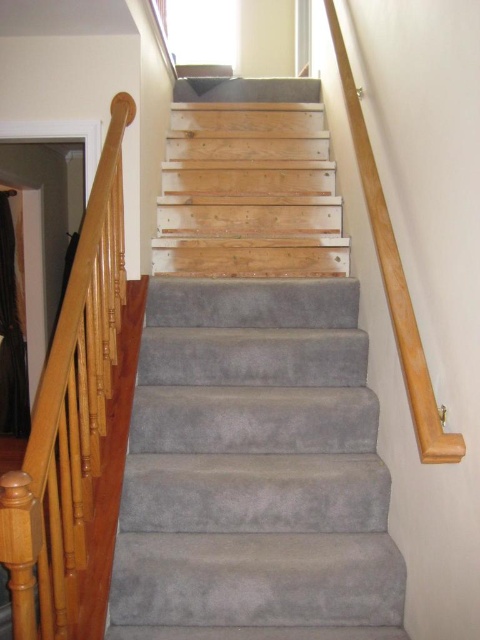
Question: Which point is farther to the camera?

Choices:
 (A) wooden handrail at left
 (B) gray carpeted stairs at center

Answer: (B)

Question: Is gray carpeted stairs at center above wooden handrail at left?

Choices:
 (A) no
 (B) yes

Answer: (A)

Question: Does gray carpeted stairs at center have a smaller size compared to wooden handrail at left?

Choices:
 (A) yes
 (B) no

Answer: (B)

Question: Which object is farther from the camera taking this photo?

Choices:
 (A) gray carpeted stairs at center
 (B) wooden handrail at left

Answer: (A)

Question: Can you confirm if gray carpeted stairs at center is positioned above wooden handrail at left?

Choices:
 (A) no
 (B) yes

Answer: (A)